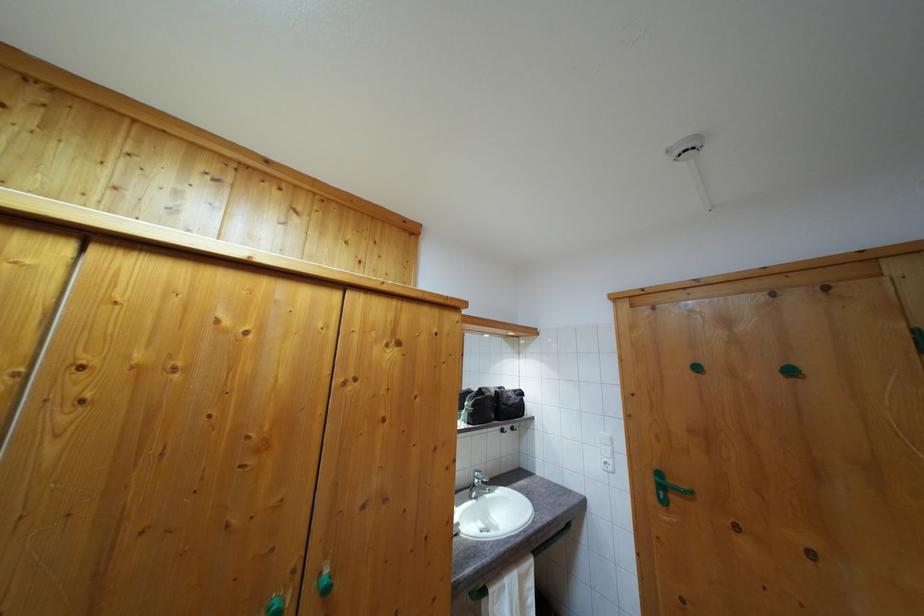
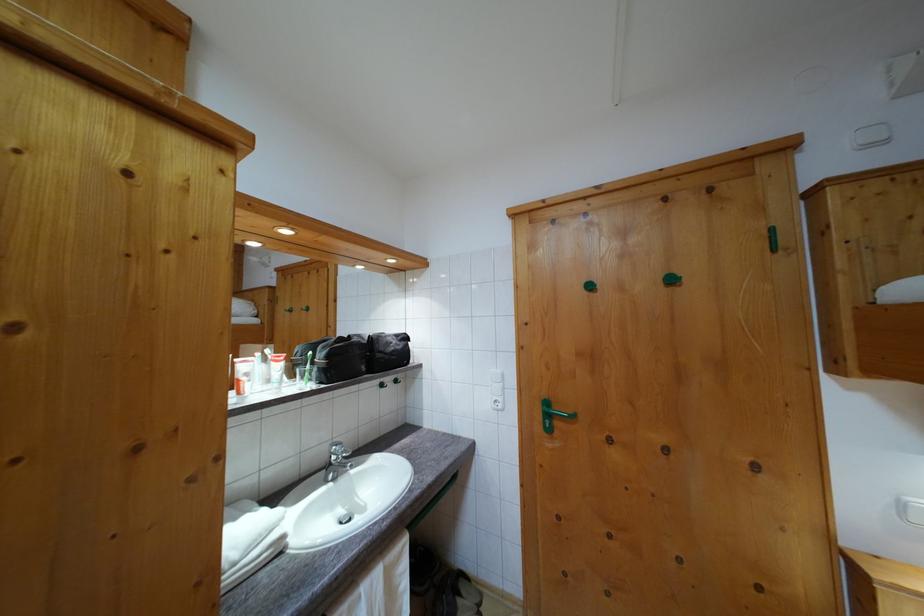
The point at (795, 379) is marked in the first image. Where is the corresponding point in the second image?

(675, 286)